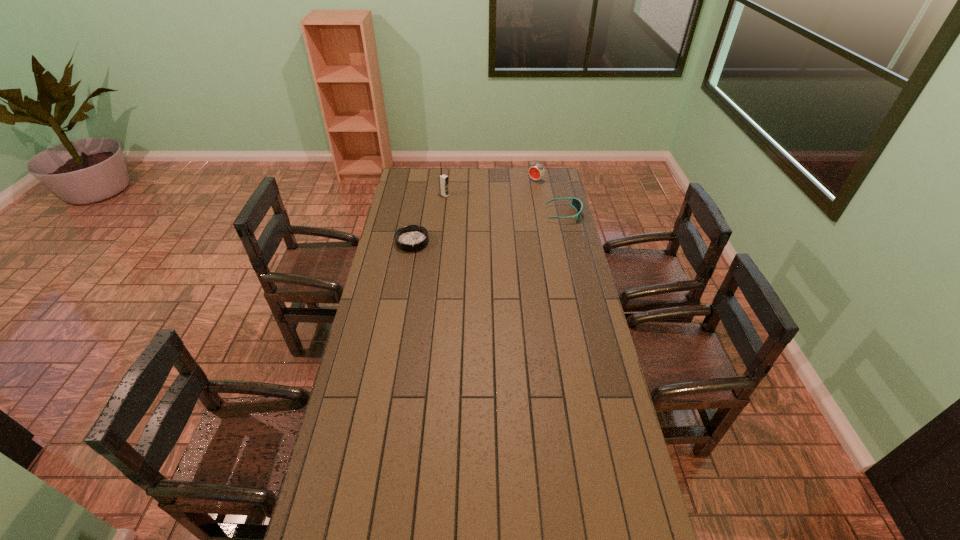
Where is `vacant area between the alarm clock and the tallest object`? This screenshot has width=960, height=540. vacant area between the alarm clock and the tallest object is located at coordinates (491, 188).

Where is `vacant area between the third nearest object and the third farthest object`? The image size is (960, 540). vacant area between the third nearest object and the third farthest object is located at coordinates (504, 205).

Locate an element on the screen. free space that is in between the third shortest object and the nearest object is located at coordinates (474, 211).

Identify the location of free area in between the sunglasses and the tallest object. (504, 205).

Locate an element on the screen. This screenshot has width=960, height=540. free spot between the second shortest object and the shortest object is located at coordinates (488, 228).

Where is `vacant space in between the third farthest object and the ashtray`? The height and width of the screenshot is (540, 960). vacant space in between the third farthest object and the ashtray is located at coordinates (488, 228).

This screenshot has height=540, width=960. I want to click on object that is the second closest to the second shortest object, so click(x=443, y=179).

Identify which object is located as the second nearest to the farthest object. Please provide its 2D coordinates. Your answer should be formatted as a tuple, i.e. [(x, y)], where the tuple contains the x and y coordinates of a point satisfying the conditions above.

[(443, 179)]

Locate an element on the screen. This screenshot has width=960, height=540. blank area in the image that satisfies the following two spatial constraints: 1. on the back side of the sunglasses; 2. on the front-facing side of the shortest object is located at coordinates coord(418,214).

Locate an element on the screen. The width and height of the screenshot is (960, 540). vacant space that satisfies the following two spatial constraints: 1. on the front side of the second object from left to right; 2. on the front-facing side of the third farthest object is located at coordinates (443, 214).